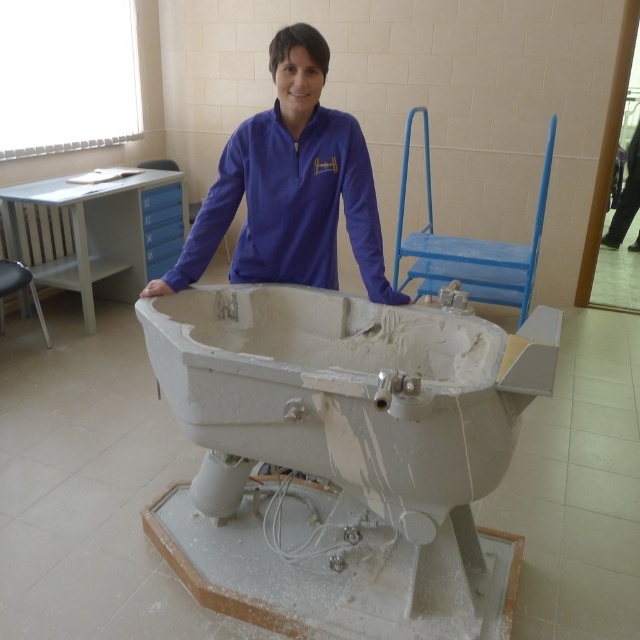
Question: Among these points, which one is nearest to the camera?

Choices:
 (A) tap(278, 273)
 (B) tap(467, 374)

Answer: (B)

Question: Can you confirm if white matte bathtub at center is positioned above purple fleece at center?

Choices:
 (A) no
 (B) yes

Answer: (A)

Question: Can you confirm if white matte bathtub at center is smaller than purple fleece at center?

Choices:
 (A) no
 (B) yes

Answer: (A)

Question: Can you confirm if white matte bathtub at center is thinner than purple fleece at center?

Choices:
 (A) yes
 (B) no

Answer: (B)